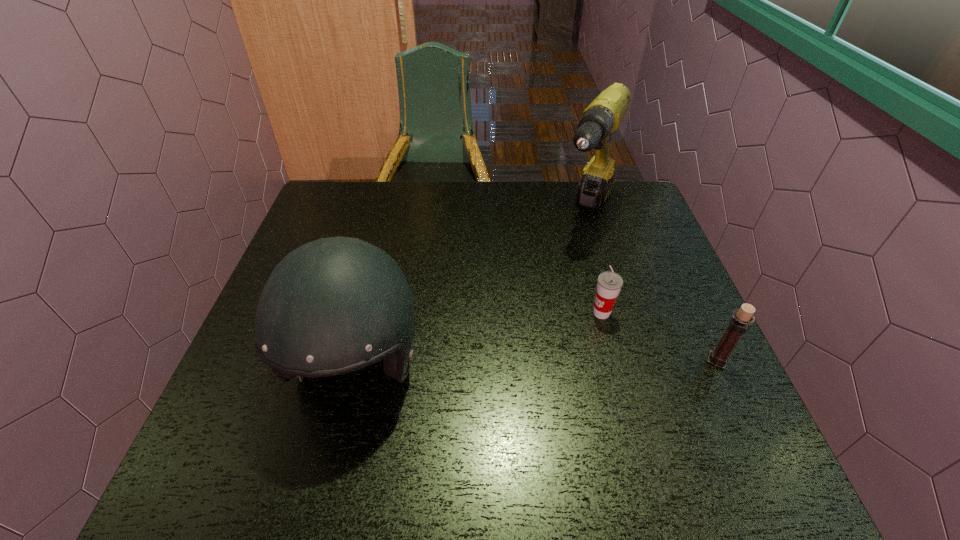
Find the location of a particular element. Image resolution: width=960 pixels, height=540 pixels. vacant space on the desktop that is between the football helmet and the candle holder and is positioned on the handle side of the farthest object is located at coordinates (499, 363).

The width and height of the screenshot is (960, 540). I want to click on vacant space on the desktop that is between the football helmet and the candle holder and is positioned on the side of the shortest object with the logo, so click(516, 363).